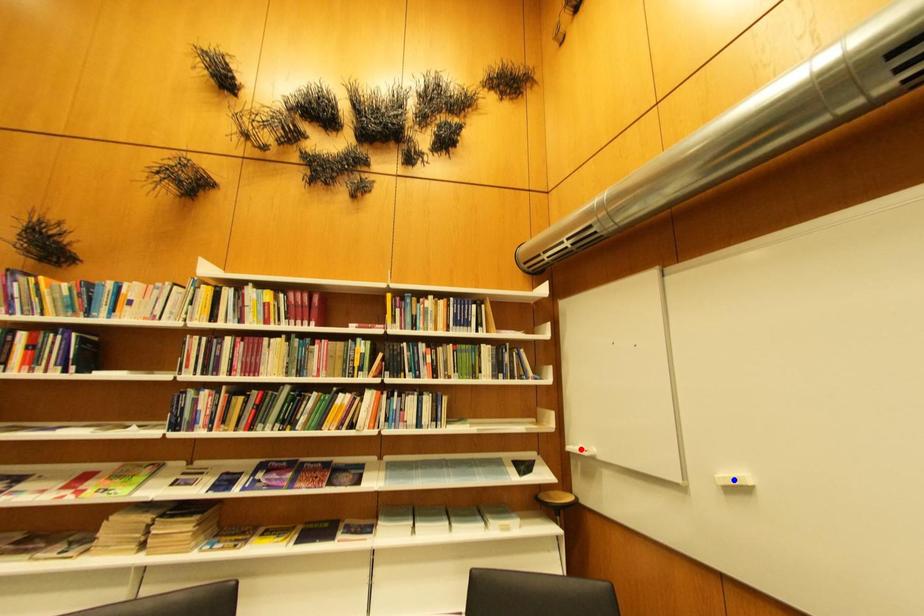
Question: Which of the two points in the image is closer to the camera?

Choices:
 (A) Blue point is closer.
 (B) Red point is closer.

Answer: (A)